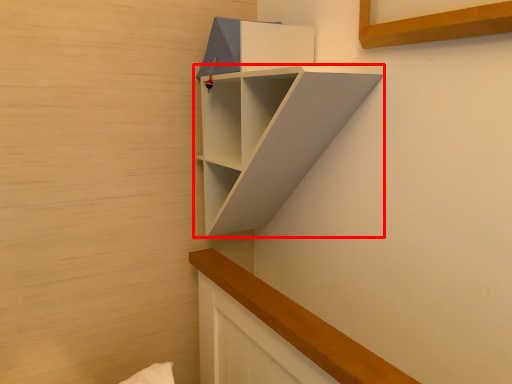
Question: From the image's perspective, where is shelf (annotated by the red box) located relative to cabinet?

Choices:
 (A) below
 (B) above

Answer: (A)